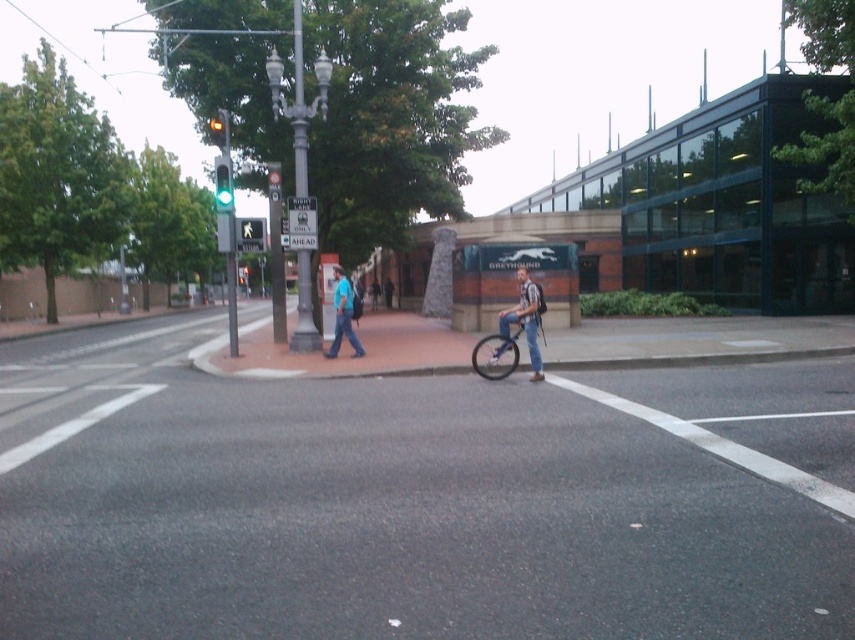
You are a delivery robot that needs to deliver a package to the pedestrian crossing. You see the denim jeans at center and the black plastic pedestrian crossing at center. Which object is narrower in width?

The denim jeans at center is thinner than the black plastic pedestrian crossing at center, so the denim jeans at center is narrower in width.

Based on the photo, you are a pedestrian standing at the edge of the black plastic pedestrian crossing at center. You see the denim jeans at center moving towards you. Which direction should you step to avoid collision?

The denim jeans at center is closer to you than the black plastic pedestrian crossing at center, so you should step to the side to avoid collision.

You are a pedestrian standing at the edge of the road and want to cross to the other side. There is a person riding a unicycle wearing denim jeans at center in the middle of the road. Based on their position, can you safely cross in front of them without obstructing their path?

The denim jeans at center is located at point [523,321], so yes, you can safely cross in front of them if their position allows enough space, but ensure you check their actual distance and movement before proceeding.